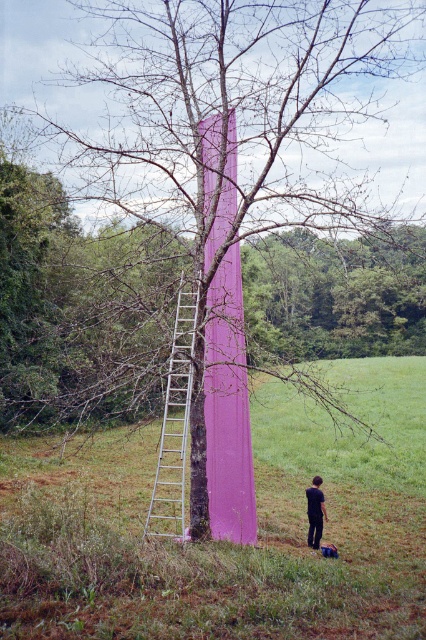
You are a painter trying to decide whether to place a 2.5 meter wide tarp next to the silver metallic ladder at center and the black matte pants at lower right. Based on their widths, will the tarp fit between them without overlapping?

The silver metallic ladder at center is wider than the black matte pants at lower right. Since the tarp is 2.5 meters wide, you need to ensure there is enough space between them. However, the exact distance between the ladder and the pants isn

You are standing at the center of the image and want to move towards the silver metallic ladder at center. Which direction should you move to reach it?

You should move towards the center of the image to reach the silver metallic ladder at center since it is located at point (175, 426).

You are a painter who needs to reach the top of the pink matte tower at center to touch up some paint. You have a ladder that is the same height as the black matte pants at lower right. Will this ladder be tall enough?

The pink matte tower at center has a greater height compared to the black matte pants at lower right. Therefore, the ladder, which is the same height as the black matte pants at lower right, will not be tall enough to reach the top of the pink matte tower at center.